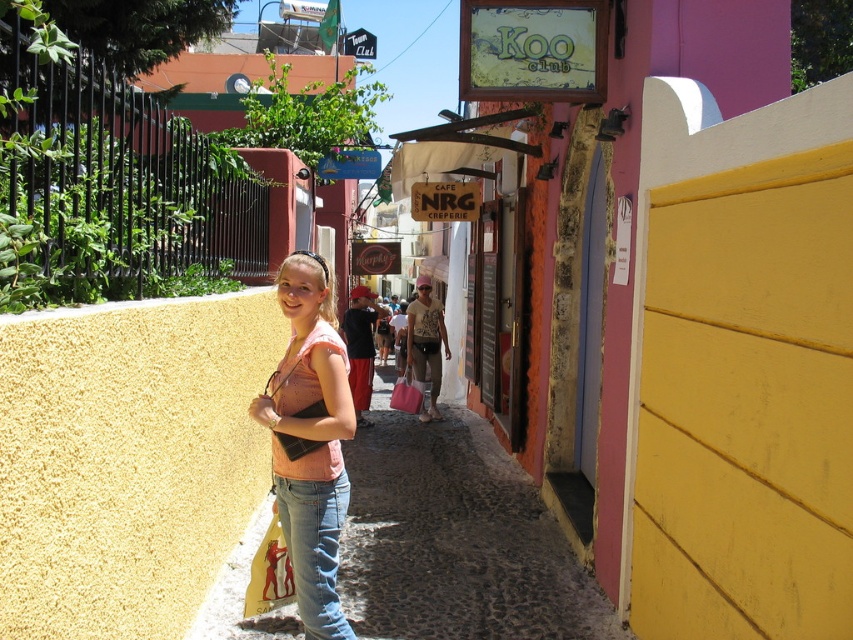
You are a photographer trying to capture a clear shot of the yellow fabric shopping bag at center and the pink fabric shopping bag at center. Which one is closer to the camera?

The yellow fabric shopping bag at center is closer to the camera because it is in front of the pink fabric shopping bag at center.

You are a photographer trying to capture the woman in the scene. You want to ensure both the denim jeans at center and the pink fabric shopping bag at center are clearly visible in your shot. Which object should you focus on first to ensure they are both in frame?

Result: You should focus on the pink fabric shopping bag at center first because the denim jeans at center are to the left of it, so by centering the bag, the jeans will naturally be included in the frame to its left.